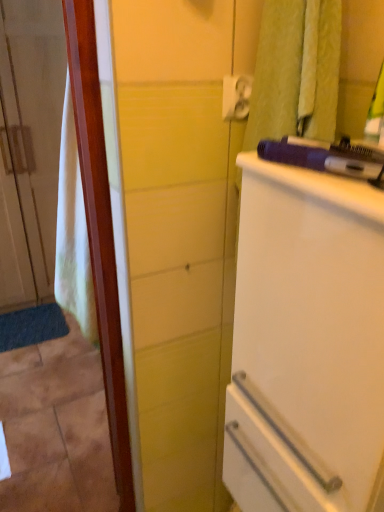
Question: Is white plastic towel bar at upper right oriented towards white glossy refrigerator at right?

Choices:
 (A) no
 (B) yes

Answer: (A)

Question: Does white plastic towel bar at upper right have a greater height compared to white glossy refrigerator at right?

Choices:
 (A) no
 (B) yes

Answer: (A)

Question: Can you confirm if white plastic towel bar at upper right is bigger than white glossy refrigerator at right?

Choices:
 (A) yes
 (B) no

Answer: (B)

Question: Does white plastic towel bar at upper right have a greater width compared to white glossy refrigerator at right?

Choices:
 (A) no
 (B) yes

Answer: (A)

Question: Can we say white plastic towel bar at upper right lies outside white glossy refrigerator at right?

Choices:
 (A) yes
 (B) no

Answer: (A)

Question: Is white plastic towel bar at upper right turned away from white glossy refrigerator at right?

Choices:
 (A) no
 (B) yes

Answer: (A)

Question: Considering the relative sizes of white glossy refrigerator at right and purple plastic hairdryer at upper right in the image provided, is white glossy refrigerator at right bigger than purple plastic hairdryer at upper right?

Choices:
 (A) no
 (B) yes

Answer: (B)

Question: Considering the relative sizes of white glossy refrigerator at right and purple plastic hairdryer at upper right in the image provided, is white glossy refrigerator at right taller than purple plastic hairdryer at upper right?

Choices:
 (A) no
 (B) yes

Answer: (B)

Question: Is white glossy refrigerator at right not within purple plastic hairdryer at upper right?

Choices:
 (A) no
 (B) yes

Answer: (B)

Question: From a real-world perspective, is white glossy refrigerator at right below purple plastic hairdryer at upper right?

Choices:
 (A) yes
 (B) no

Answer: (A)

Question: Is white glossy refrigerator at right at the left side of purple plastic hairdryer at upper right?

Choices:
 (A) yes
 (B) no

Answer: (B)

Question: Does white glossy refrigerator at right have a lesser width compared to purple plastic hairdryer at upper right?

Choices:
 (A) yes
 (B) no

Answer: (B)

Question: Considering the relative sizes of white glossy refrigerator at right and white plastic towel bar at upper right in the image provided, is white glossy refrigerator at right smaller than white plastic towel bar at upper right?

Choices:
 (A) yes
 (B) no

Answer: (B)